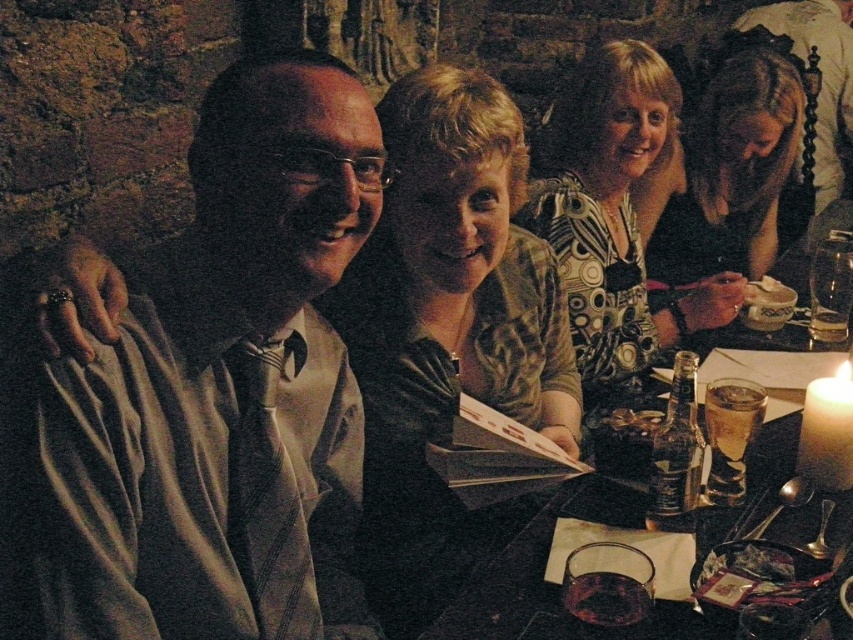
Question: Is matte white shirt at left positioned before blonde hair at upper right?

Choices:
 (A) no
 (B) yes

Answer: (B)

Question: Is printed fabric dress at upper center positioned at the back of translucent glass at lower center?

Choices:
 (A) no
 (B) yes

Answer: (B)

Question: Which is farther from the translucent glass at lower center?

Choices:
 (A) translucent glass bottle at table center
 (B) matte white shirt at left
 (C) blonde hair at upper right
 (D) translucent glass at center

Answer: (C)

Question: Is printed fabric dress at upper center wider than clear glass wine glass at right?

Choices:
 (A) yes
 (B) no

Answer: (A)

Question: Which object is positioned closest to the clear glass wine glass at right?

Choices:
 (A) printed fabric dress at upper center
 (B) translucent glass at lower center

Answer: (A)

Question: Estimate the real-world distances between objects in this image. Which object is farther from the matte white shirt at left?

Choices:
 (A) printed fabric dress at upper center
 (B) translucent glass at table right

Answer: (B)